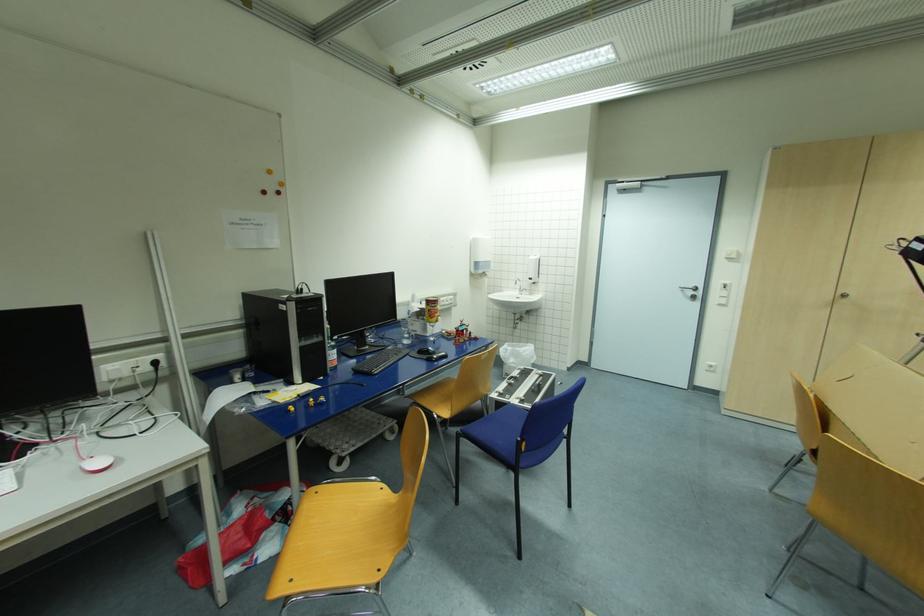
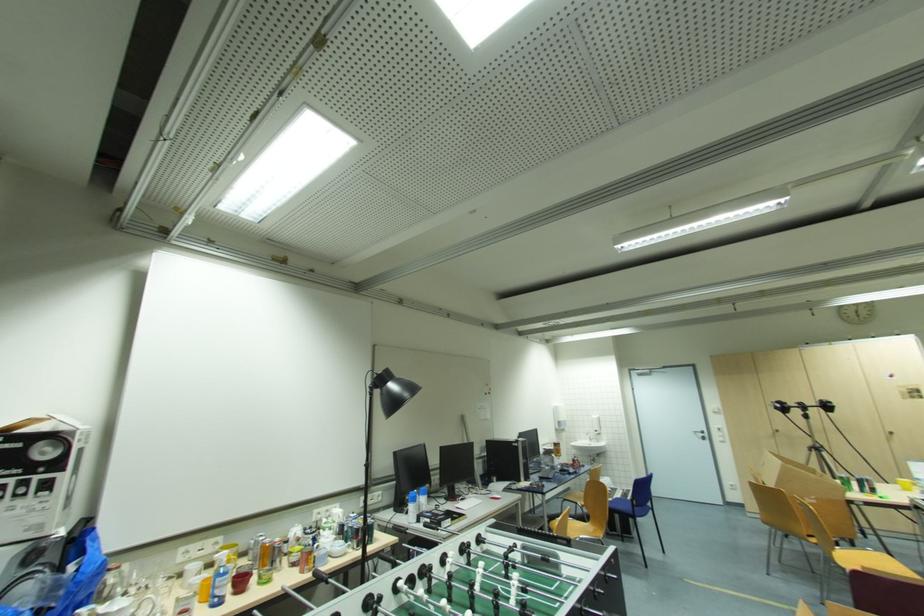
Find the pixel in the second image that matches (696,293) in the first image.

(706, 436)